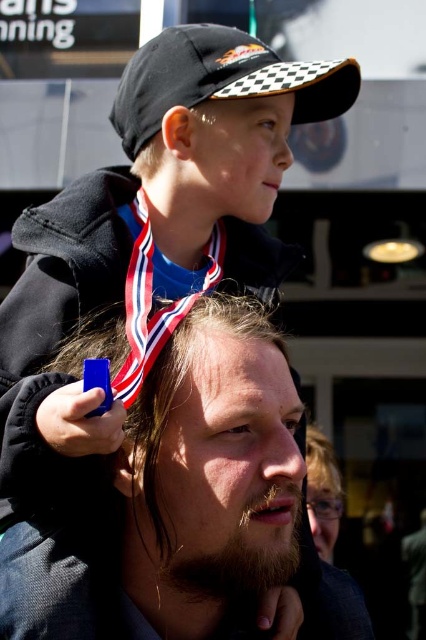
Question: Among these objects, which one is nearest to the camera?

Choices:
 (A) dark brown textured hair at center
 (B) matte blue neck at center
 (C) black checkered baseball cap at upper center

Answer: (A)

Question: Is dark brown textured hair at center to the right of black checkered baseball cap at upper center from the viewer's perspective?

Choices:
 (A) yes
 (B) no

Answer: (B)

Question: Can you confirm if dark brown textured hair at center is positioned to the right of matte blue neck at center?

Choices:
 (A) yes
 (B) no

Answer: (A)

Question: Which of the following is the farthest from the observer?

Choices:
 (A) (218, 564)
 (B) (247, 81)
 (C) (138, 209)

Answer: (C)

Question: Does dark brown textured hair at center have a lesser width compared to black checkered baseball cap at upper center?

Choices:
 (A) no
 (B) yes

Answer: (A)

Question: Which of these objects is positioned closest to the dark brown textured hair at center?

Choices:
 (A) black checkered baseball cap at upper center
 (B) matte blue neck at center

Answer: (B)